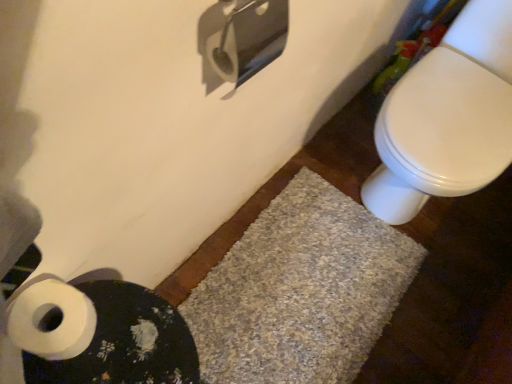
Question: Is white textured bath mat at lower left, the 1th bath mat viewed from the front, oriented towards white glossy toilet at right?

Choices:
 (A) no
 (B) yes

Answer: (A)

Question: Does white textured bath mat at lower left, which is the second bath mat in back-to-front order, have a larger size compared to white glossy toilet at right?

Choices:
 (A) no
 (B) yes

Answer: (A)

Question: Does white textured bath mat at lower left, which is the second bath mat in back-to-front order, appear on the right side of white glossy toilet at right?

Choices:
 (A) no
 (B) yes

Answer: (A)

Question: Is white textured bath mat at lower left, which is the second bath mat in back-to-front order, looking in the opposite direction of white glossy toilet at right?

Choices:
 (A) no
 (B) yes

Answer: (A)

Question: Would you consider white textured bath mat at lower left, the 1th bath mat viewed from the front, to be distant from white glossy toilet at right?

Choices:
 (A) yes
 (B) no

Answer: (B)

Question: Would you say white textured bath mat at lower left, the 1th bath mat viewed from the front, is to the left or to the right of gray shaggy bath mat at lower center, which appears as the second bath mat when viewed from the front, in the picture?

Choices:
 (A) left
 (B) right

Answer: (A)

Question: From their relative heights in the image, would you say white textured bath mat at lower left, the 1th bath mat viewed from the front, is taller or shorter than gray shaggy bath mat at lower center, which appears as the second bath mat when viewed from the front?

Choices:
 (A) short
 (B) tall

Answer: (B)

Question: From a real-world perspective, relative to gray shaggy bath mat at lower center, which appears as the second bath mat when viewed from the front, is white textured bath mat at lower left, the 1th bath mat viewed from the front, vertically above or below?

Choices:
 (A) below
 (B) above

Answer: (B)

Question: Do you think white textured bath mat at lower left, which is the second bath mat in back-to-front order, is within gray shaggy bath mat at lower center, which appears as the second bath mat when viewed from the front, or outside of it?

Choices:
 (A) inside
 (B) outside

Answer: (B)

Question: In terms of size, does gray shaggy bath mat at lower center, which is the 1th bath mat in back-to-front order, appear bigger or smaller than white glossy toilet at right?

Choices:
 (A) small
 (B) big

Answer: (A)

Question: Is gray shaggy bath mat at lower center, which appears as the second bath mat when viewed from the front, taller or shorter than white glossy toilet at right?

Choices:
 (A) short
 (B) tall

Answer: (A)

Question: From a real-world perspective, is gray shaggy bath mat at lower center, which is the 1th bath mat in back-to-front order, positioned above or below white glossy toilet at right?

Choices:
 (A) below
 (B) above

Answer: (A)

Question: Is gray shaggy bath mat at lower center, which is the 1th bath mat in back-to-front order, to the left or to the right of white glossy toilet at right in the image?

Choices:
 (A) right
 (B) left

Answer: (B)

Question: Visually, is gray shaggy bath mat at lower center, which appears as the second bath mat when viewed from the front, positioned to the left or to the right of white matte toilet paper at lower left?

Choices:
 (A) left
 (B) right

Answer: (B)

Question: Considering the positions of gray shaggy bath mat at lower center, which appears as the second bath mat when viewed from the front, and white matte toilet paper at lower left in the image, is gray shaggy bath mat at lower center, which appears as the second bath mat when viewed from the front, wider or thinner than white matte toilet paper at lower left?

Choices:
 (A) thin
 (B) wide

Answer: (B)